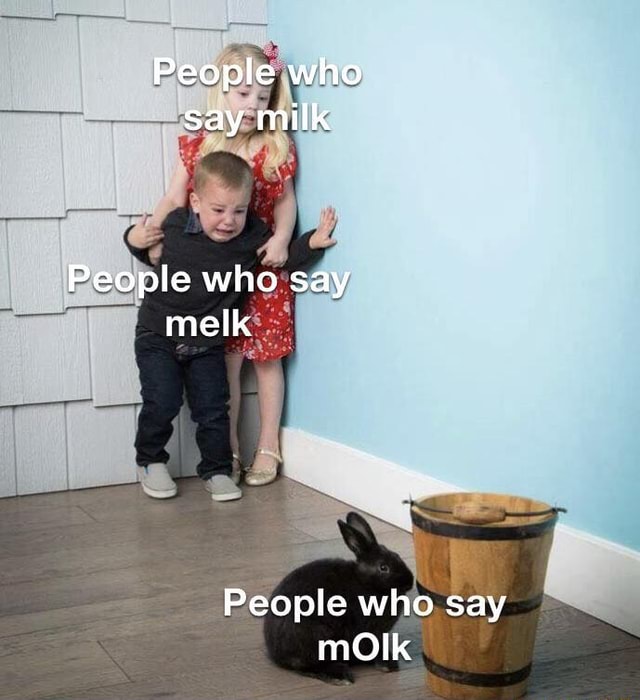
What are the coordinates of `wooden barrel-type bucket` in the screenshot? It's located at (484, 565).